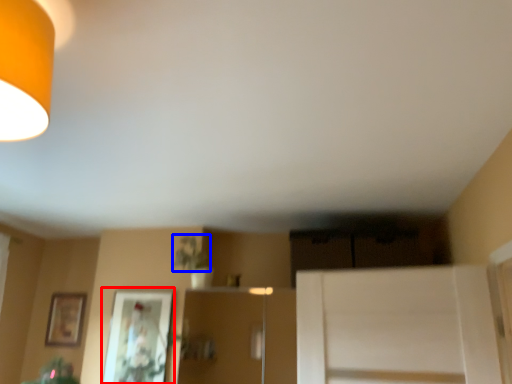
Question: Which point is further to the camera, picture frame (highlighted by a red box) or plant (highlighted by a blue box)?

Choices:
 (A) picture frame
 (B) plant

Answer: (A)